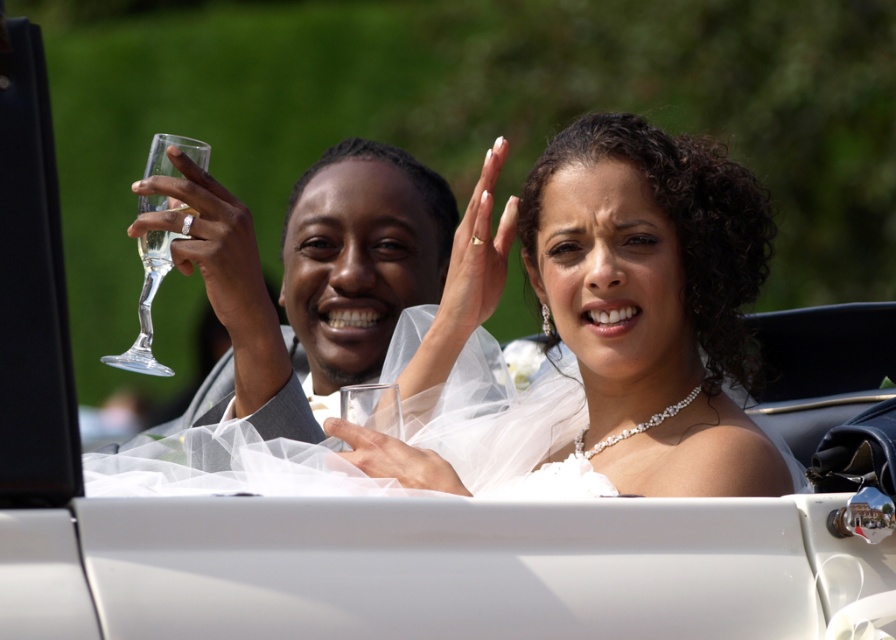
Is pearl necklace at center positioned at the back of clear glass flute at upper left?

No.

Does pearl necklace at center come in front of clear glass flute at upper left?

Yes, it is.

The width and height of the screenshot is (896, 640). Describe the element at coordinates (629, 298) in the screenshot. I see `pearl necklace at center` at that location.

Identify the location of pearl necklace at center. (629, 298).

Can you confirm if clear glass flute at upper left is positioned below clear glass wine glass at upper left?

Yes, clear glass flute at upper left is below clear glass wine glass at upper left.

Is clear glass flute at upper left shorter than clear glass wine glass at upper left?

No, clear glass flute at upper left is not shorter than clear glass wine glass at upper left.

Who is more forward, (x=300, y=189) or (x=177, y=141)?

Point (x=177, y=141)

You are a GUI agent. You are given a task and a screenshot of the screen. Output one action in this format:
    pyautogui.click(x=<x>, y=<y>)
    Task: Click on the clear glass flute at upper left
    
    Given the screenshot: What is the action you would take?
    pyautogui.click(x=332, y=275)

Is pearl necklace at center to the right of clear glass wine glass at upper left from the viewer's perspective?

Indeed, pearl necklace at center is positioned on the right side of clear glass wine glass at upper left.

Is pearl necklace at center shorter than clear glass wine glass at upper left?

Incorrect, pearl necklace at center's height does not fall short of clear glass wine glass at upper left's.

Does point (472, 323) come closer to viewer compared to point (139, 330)?

No, it is not.

I want to click on pearl necklace at center, so click(x=629, y=298).